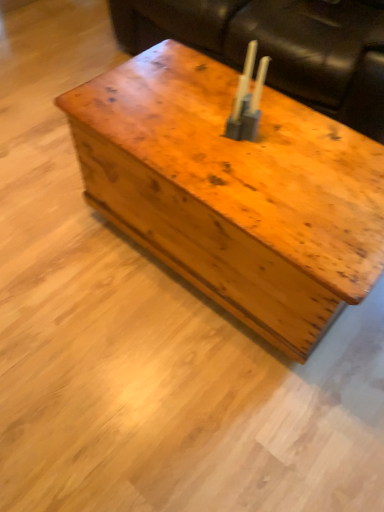
Question: Can you confirm if leather couch at upper center is thinner than metallic silver candle holder at center?

Choices:
 (A) no
 (B) yes

Answer: (A)

Question: Does leather couch at upper center come behind metallic silver candle holder at center?

Choices:
 (A) no
 (B) yes

Answer: (B)

Question: Does leather couch at upper center have a lesser height compared to metallic silver candle holder at center?

Choices:
 (A) no
 (B) yes

Answer: (A)

Question: From the image's perspective, is leather couch at upper center below metallic silver candle holder at center?

Choices:
 (A) yes
 (B) no

Answer: (B)

Question: From the image's perspective, would you say leather couch at upper center is positioned over metallic silver candle holder at center?

Choices:
 (A) no
 (B) yes

Answer: (B)

Question: Is leather couch at upper center bigger than metallic silver candle holder at center?

Choices:
 (A) yes
 (B) no

Answer: (A)

Question: Considering the relative sizes of leather couch at upper center and wooden trunk at center in the image provided, is leather couch at upper center smaller than wooden trunk at center?

Choices:
 (A) yes
 (B) no

Answer: (B)

Question: Is the surface of leather couch at upper center in direct contact with wooden trunk at center?

Choices:
 (A) yes
 (B) no

Answer: (B)

Question: From the image's perspective, would you say leather couch at upper center is shown under wooden trunk at center?

Choices:
 (A) no
 (B) yes

Answer: (A)

Question: Would you say leather couch at upper center is a long distance from wooden trunk at center?

Choices:
 (A) no
 (B) yes

Answer: (A)

Question: Is leather couch at upper center positioned in front of wooden trunk at center?

Choices:
 (A) yes
 (B) no

Answer: (B)

Question: From a real-world perspective, is leather couch at upper center positioned over wooden trunk at center based on gravity?

Choices:
 (A) yes
 (B) no

Answer: (A)

Question: Is leather couch at upper center at the back of metallic silver candle holder at center?

Choices:
 (A) no
 (B) yes

Answer: (B)